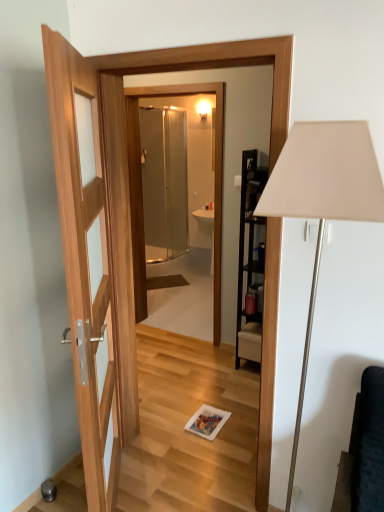
Where is `free space in front of transparent glass shower at center`? The height and width of the screenshot is (512, 384). free space in front of transparent glass shower at center is located at coordinates (177, 361).